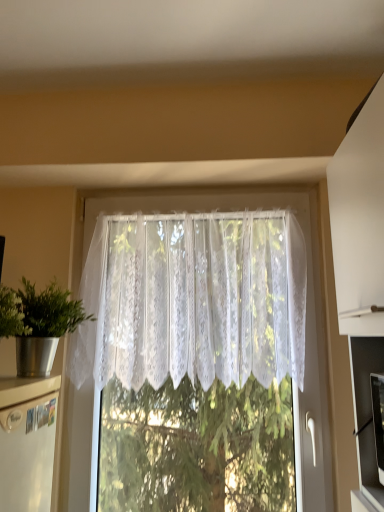
Question: Is white lace curtain at center at the left side of metallic silver pot at left?

Choices:
 (A) no
 (B) yes

Answer: (A)

Question: Does white lace curtain at center have a smaller size compared to metallic silver pot at left?

Choices:
 (A) no
 (B) yes

Answer: (A)

Question: Is white lace curtain at center taller than metallic silver pot at left?

Choices:
 (A) no
 (B) yes

Answer: (B)

Question: From a real-world perspective, is white lace curtain at center beneath metallic silver pot at left?

Choices:
 (A) yes
 (B) no

Answer: (B)

Question: From the image's perspective, would you say white lace curtain at center is shown under metallic silver pot at left?

Choices:
 (A) yes
 (B) no

Answer: (B)

Question: Is white lace curtain at center not inside metallic silver pot at left?

Choices:
 (A) yes
 (B) no

Answer: (A)

Question: Could you tell me if metallic silver pot at left is turned towards white lace curtain at center?

Choices:
 (A) yes
 (B) no

Answer: (B)

Question: Is metallic silver pot at left located outside white lace curtain at center?

Choices:
 (A) yes
 (B) no

Answer: (A)

Question: Does metallic silver pot at left have a greater height compared to white lace curtain at center?

Choices:
 (A) yes
 (B) no

Answer: (B)

Question: Is white lace curtain at center a part of metallic silver pot at left?

Choices:
 (A) no
 (B) yes

Answer: (A)

Question: Considering the relative sizes of metallic silver pot at left and white lace curtain at center in the image provided, is metallic silver pot at left bigger than white lace curtain at center?

Choices:
 (A) yes
 (B) no

Answer: (B)

Question: Is metallic silver pot at left looking in the opposite direction of white lace curtain at center?

Choices:
 (A) no
 (B) yes

Answer: (A)

Question: From a real-world perspective, is white lace curtain at center physically located above or below metallic silver pot at left?

Choices:
 (A) below
 (B) above

Answer: (B)